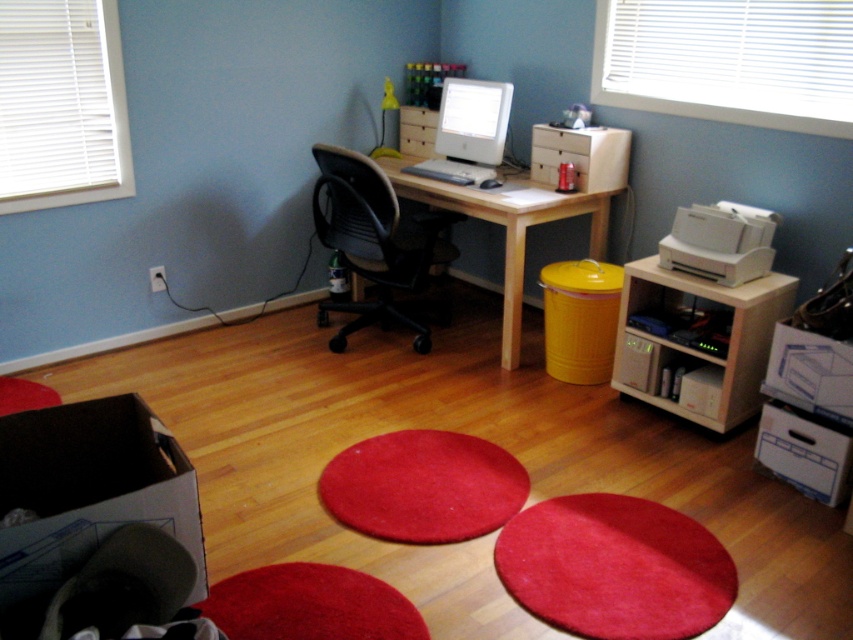
Does shiny red rug at lower center appear over white plastic printer at right?

Actually, shiny red rug at lower center is below white plastic printer at right.

Is point (250, 577) in front of point (741, 282)?

Yes, it is.

Between point (262, 608) and point (669, 244), which one is positioned behind?

Point (669, 244)

I want to click on shiny red rug at lower center, so click(310, 604).

Can you confirm if black mesh swivel chair at center is bigger than white plastic printer at right?

Yes.

Is the position of black mesh swivel chair at center less distant than that of white plastic printer at right?

That is False.

Is point (368, 209) less distant than point (726, 268)?

That is False.

Find the location of a particular element. black mesh swivel chair at center is located at coordinates (376, 244).

Consider the image. Is yellow matte trash can at lower center positioned before white plastic printer at right?

That is False.

Between yellow matte trash can at lower center and white plastic printer at right, which one is positioned lower?

white plastic printer at right is lower down.

Is point (426, 179) positioned behind point (741, 244)?

Yes, point (426, 179) is behind point (741, 244).

Locate an element on the screen. The width and height of the screenshot is (853, 640). yellow matte trash can at lower center is located at coordinates (508, 227).